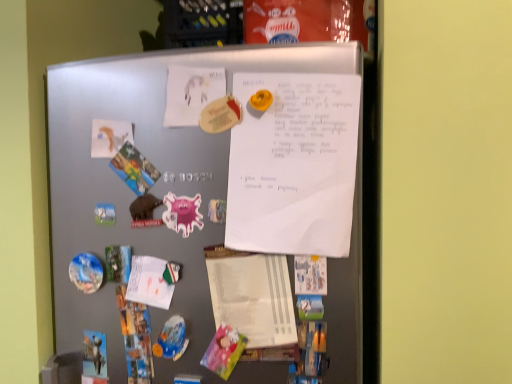
Question: In the image, is white paper notepad at center on the left side or the right side of white matte paper at upper left?

Choices:
 (A) right
 (B) left

Answer: (A)

Question: Do you think white paper notepad at center is within white matte paper at upper left, or outside of it?

Choices:
 (A) inside
 (B) outside

Answer: (B)

Question: Which of these objects is positioned farthest from the white paper at upper center, placed as the 2th poster when sorted from left to right?

Choices:
 (A) satin silver refrigerator at center
 (B) white matte paper at upper left
 (C) pink glossy magnet at center-left
 (D) matte paper poster at upper center, the 2th poster when ordered from right to left
 (E) white paper notepad at center

Answer: (B)

Question: Considering the real-world distances, which object is closest to the white paper at upper center, placed as the 2th poster when sorted from left to right?

Choices:
 (A) matte paper poster at upper center, the 2th poster when ordered from right to left
 (B) pink glossy magnet at center-left
 (C) white matte paper at upper left
 (D) white paper notepad at center
 (E) satin silver refrigerator at center

Answer: (E)